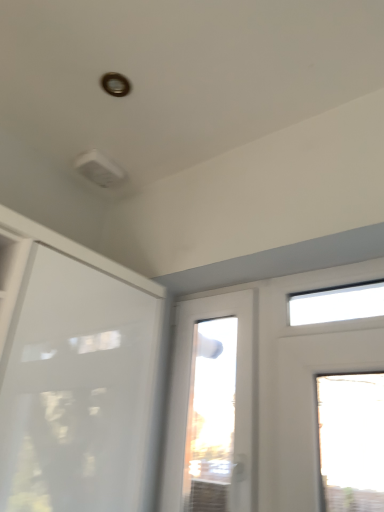
Question: Looking at the image, does white glossy door at center seem bigger or smaller compared to white matte door at upper left?

Choices:
 (A) small
 (B) big

Answer: (A)

Question: Considering the positions of point (192, 501) and point (81, 404), is point (192, 501) closer or farther from the camera than point (81, 404)?

Choices:
 (A) closer
 (B) farther

Answer: (B)

Question: Which is correct: white glossy door at center is inside white matte door at upper left, or outside of it?

Choices:
 (A) inside
 (B) outside

Answer: (B)

Question: In the image, is white matte door at upper left positioned in front of or behind white glossy door at center?

Choices:
 (A) front
 (B) behind

Answer: (A)

Question: From a real-world perspective, relative to white glossy door at center, is white matte door at upper left vertically above or below?

Choices:
 (A) below
 (B) above

Answer: (A)

Question: In terms of width, does white matte door at upper left look wider or thinner when compared to white glossy door at center?

Choices:
 (A) wide
 (B) thin

Answer: (A)

Question: Considering the positions of white matte door at upper left and white glossy door at center in the image, is white matte door at upper left taller or shorter than white glossy door at center?

Choices:
 (A) tall
 (B) short

Answer: (B)